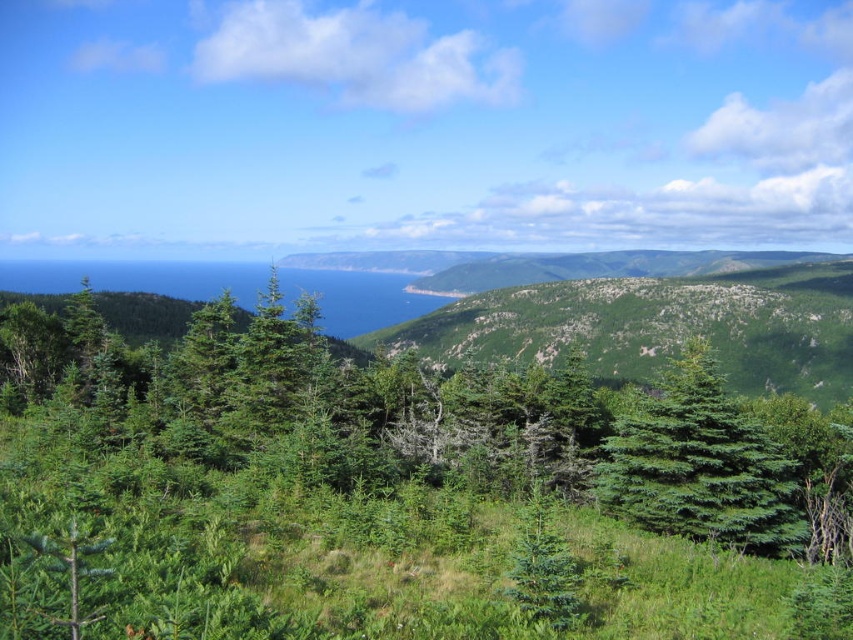
Between green matte tree at center and green matte evergreen tree at center, which one has less height?

green matte evergreen tree at center is shorter.

Between green matte tree at center and green matte evergreen tree at center, which one appears on the right side from the viewer's perspective?

green matte tree at center is more to the right.

Does point (619, 419) come farther from viewer compared to point (547, 573)?

Yes.

This screenshot has height=640, width=853. I want to click on green matte tree at center, so click(x=701, y=465).